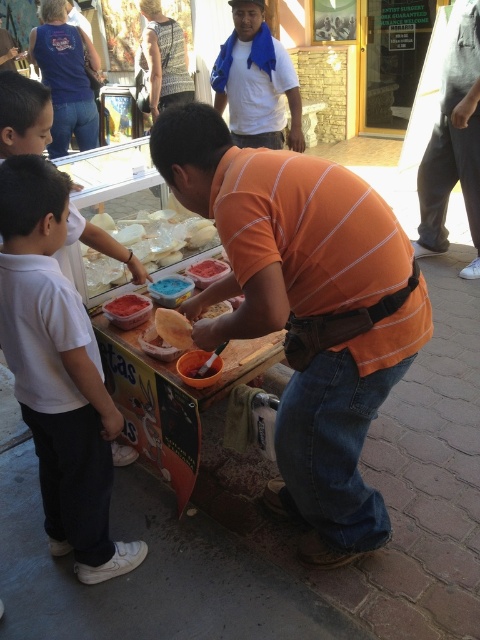
You are a customer at the food stall and want to know about the ingredients. Which of the two items, the white creamy cheese at center or the matte brown bread at center, has a greater height?

The white creamy cheese at center is much taller than the matte brown bread at center.

You are a customer at the food stall and want to know which item is bigger between the blue fabric scarf at upper center and the smooth pink ice cream at center. Can you tell me?

The blue fabric scarf at upper center has a larger size compared to the smooth pink ice cream at center, so the blue fabric scarf at upper center is bigger.

You are standing in front of the street food vendor and notice two points marked on the image. The first point is at coordinate point (277, 124) and the second is at point (220, 269). Which point is closer to you?

Point (220, 269) is closer to you because point (277, 124) is further to the camera than point (220, 269).